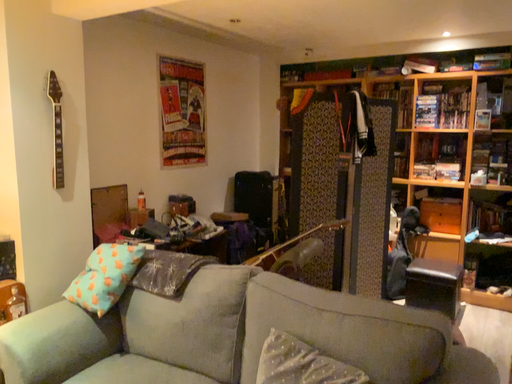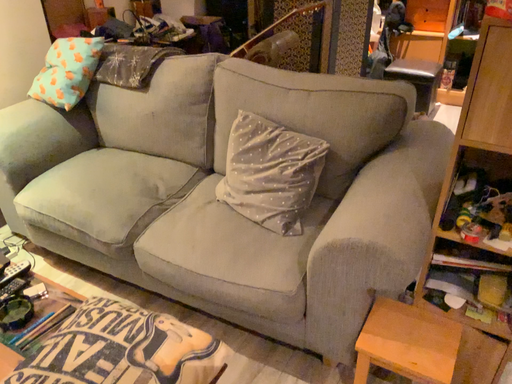
Question: How did the camera likely rotate when shooting the video?

Choices:
 (A) rotated upward
 (B) rotated downward

Answer: (B)